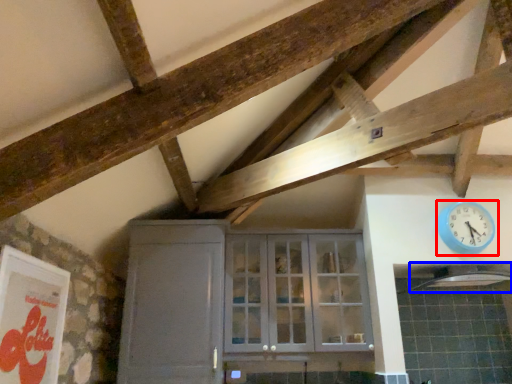
Question: Which object is further to the camera taking this photo, wall clock (highlighted by a red box) or exhaust hood (highlighted by a blue box)?

Choices:
 (A) wall clock
 (B) exhaust hood

Answer: (A)